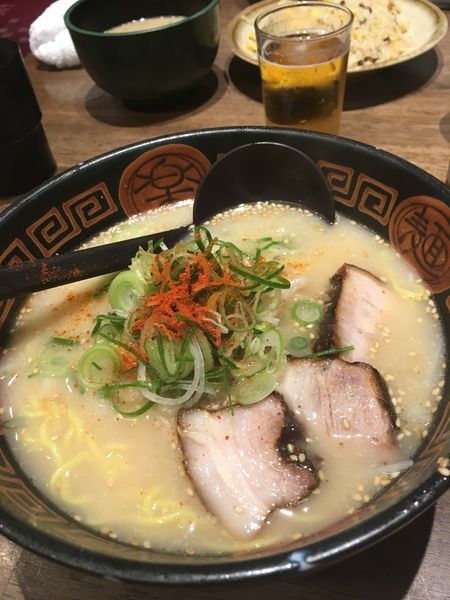
Locate an element on the screen. The image size is (450, 600). brown wooden table is located at coordinates (69, 119), (257, 117), (397, 131), (420, 581), (75, 570).